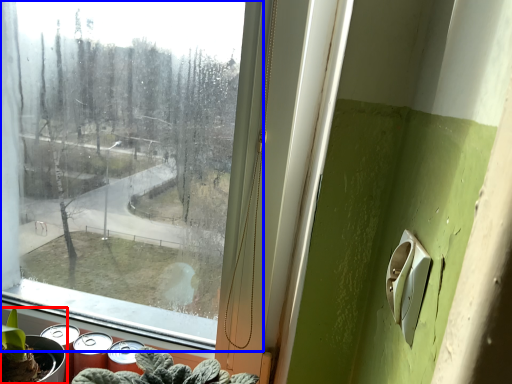
Question: Which object is further to the camera taking this photo, houseplant (highlighted by a red box) or window (highlighted by a blue box)?

Choices:
 (A) houseplant
 (B) window

Answer: (A)